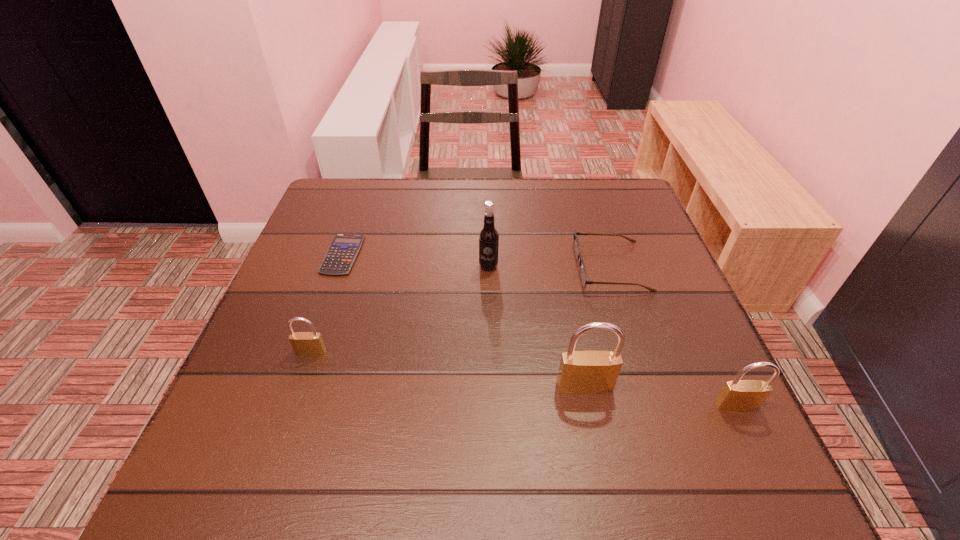
The width and height of the screenshot is (960, 540). Find the location of `vacant space at the far edge of the desktop`. vacant space at the far edge of the desktop is located at coordinates (476, 212).

Identify the location of vacant region at the near edge of the desktop. The image size is (960, 540). (474, 397).

The image size is (960, 540). Find the location of `vacant space at the left edge of the desktop`. vacant space at the left edge of the desktop is located at coordinates (295, 311).

In the image, there is a desktop. Where is `vacant space at the right edge`? Image resolution: width=960 pixels, height=540 pixels. vacant space at the right edge is located at coordinates (679, 368).

Image resolution: width=960 pixels, height=540 pixels. What are the coordinates of `vacant area at the near left corner of the desktop` in the screenshot? It's located at (225, 404).

In the image, there is a desktop. Find the location of `vacant space at the far right corner`. vacant space at the far right corner is located at coordinates (593, 180).

Identify the location of vacant position at the near right corner of the desktop. (743, 425).

At what (x,y) coordinates should I click in order to perform the action: click on free spot between the third object from left to right and the fourth farthest object. Please return your answer as a coordinate pair (x, y). Image resolution: width=960 pixels, height=540 pixels. Looking at the image, I should click on (399, 309).

Locate an element on the screen. free point between the rightmost padlock and the second padlock from right to left is located at coordinates point(660,396).

Where is `vacant space that's between the spectacles and the third object from left to right`? This screenshot has width=960, height=540. vacant space that's between the spectacles and the third object from left to right is located at coordinates (550, 267).